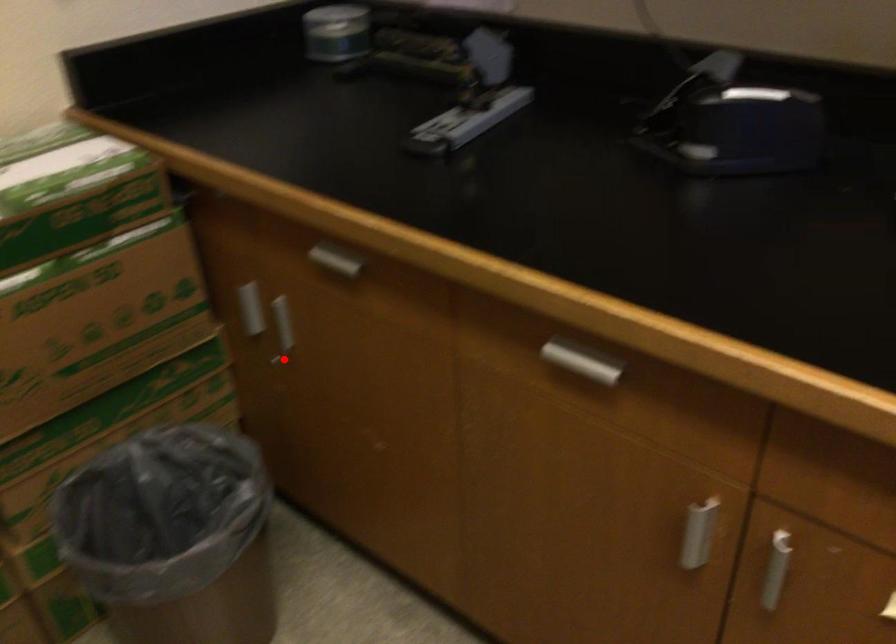
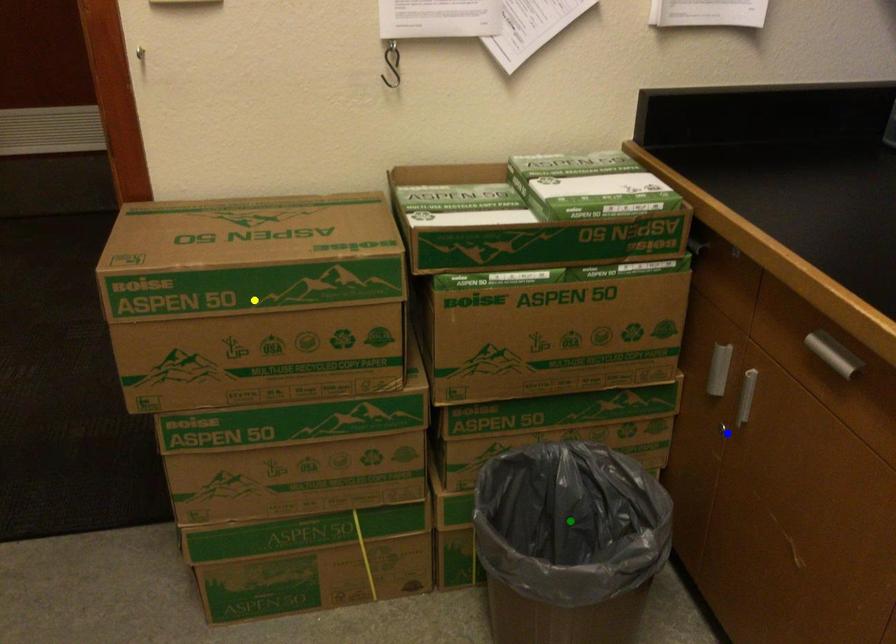
Question: I am providing you with two images of the same scene from different viewpoints. A red point is marked on the first image. You are given multiple points on the second image. Which point in image 2 represents the same 3d spot as the red point in image 1?

Choices:
 (A) yellow point
 (B) blue point
 (C) green point

Answer: (B)